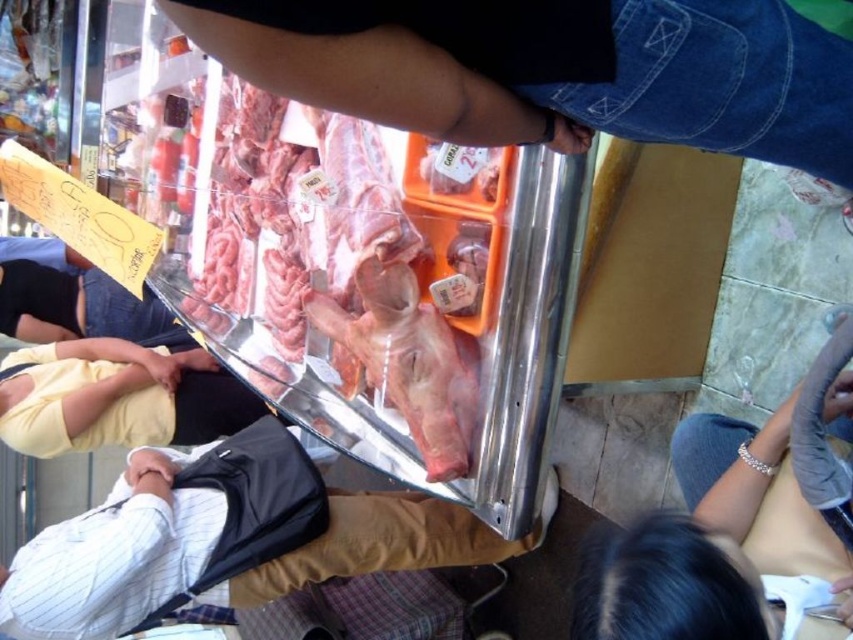
Question: Where is white striped shirt at lower left located in relation to yellow cotton shirt at lower left in the image?

Choices:
 (A) above
 (B) below

Answer: (B)

Question: Can you confirm if white striped shirt at lower left is positioned above yellow cotton shirt at lower left?

Choices:
 (A) yes
 (B) no

Answer: (B)

Question: Among these points, which one is farthest from the camera?

Choices:
 (A) (100, 602)
 (B) (97, 356)

Answer: (B)

Question: Can you confirm if white striped shirt at lower left is bigger than yellow cotton shirt at lower left?

Choices:
 (A) no
 (B) yes

Answer: (B)

Question: Which point is farther to the camera?

Choices:
 (A) (30, 378)
 (B) (86, 579)

Answer: (A)